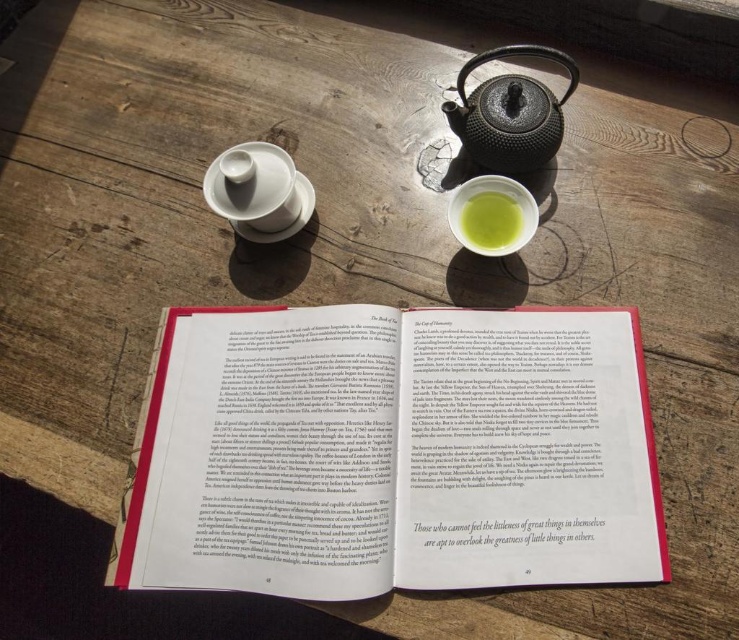
Question: Can you confirm if matte red book at center is positioned to the left of matte black teapot at upper center?

Choices:
 (A) no
 (B) yes

Answer: (B)

Question: Among these objects, which one is nearest to the camera?

Choices:
 (A) matte black teapot at upper center
 (B) matte red book at center

Answer: (B)

Question: Is the position of black textured teapot at upper center less distant than that of white matte saucer at center?

Choices:
 (A) no
 (B) yes

Answer: (B)

Question: Which object is farther from the camera taking this photo?

Choices:
 (A) black textured teapot at upper center
 (B) matte red book at center
 (C) matte green porcelain cup at center
 (D) white matte saucer at center

Answer: (D)

Question: Which object appears farthest from the camera in this image?

Choices:
 (A) green matte bowl at center
 (B) matte green porcelain cup at center
 (C) black textured teapot at upper center

Answer: (C)

Question: Can you confirm if matte red book at center is smaller than black textured teapot at upper center?

Choices:
 (A) yes
 (B) no

Answer: (B)